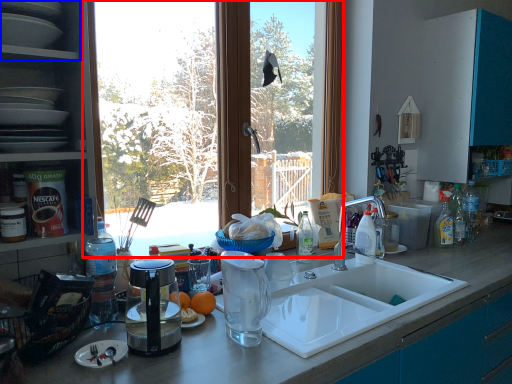
Question: Among these objects, which one is nearest to the camera, window (highlighted by a red box) or shelf (highlighted by a blue box)?

Choices:
 (A) window
 (B) shelf

Answer: (B)